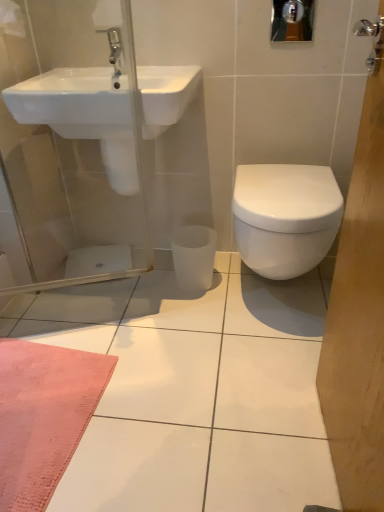
Question: Is point (109, 56) positioned closer to the camera than point (236, 179)?

Choices:
 (A) closer
 (B) farther

Answer: (A)

Question: Considering the relative positions of silver metallic tap at upper left and white glossy toilet at right in the image provided, is silver metallic tap at upper left to the left or to the right of white glossy toilet at right?

Choices:
 (A) left
 (B) right

Answer: (A)

Question: Considering the real-world distances, which object is farthest from the white glossy toilet at right?

Choices:
 (A) white glossy sink at upper left
 (B) silver metallic tap at upper left

Answer: (B)

Question: Considering the real-world distances, which object is closest to the silver metallic tap at upper left?

Choices:
 (A) white glossy sink at upper left
 (B) white glossy toilet at right

Answer: (A)